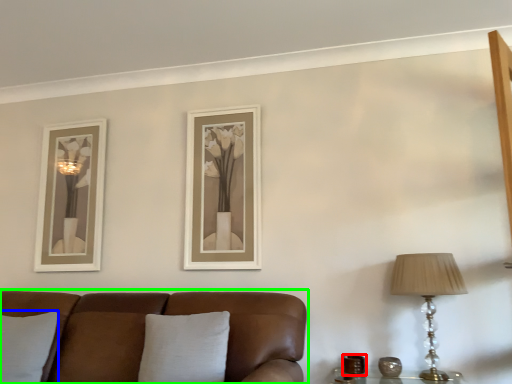
Question: Considering the real-world distances, which object is farthest from candle holder (highlighted by a red box)? pillow (highlighted by a blue box) or studio couch (highlighted by a green box)?

Choices:
 (A) pillow
 (B) studio couch

Answer: (A)